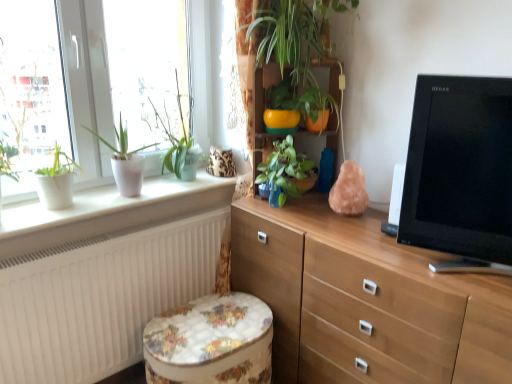
This screenshot has width=512, height=384. Find the location of `free space above floral fabric ottoman at lower center (from a real-world perspective)`. free space above floral fabric ottoman at lower center (from a real-world perspective) is located at coordinates (210, 324).